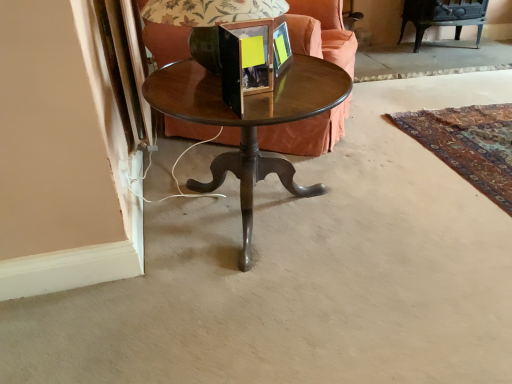
Identify the location of vacant space in between wooden picture frame at center, which is the 1th picture frame in front-to-back order, and matte black lampshade at center. (231, 108).